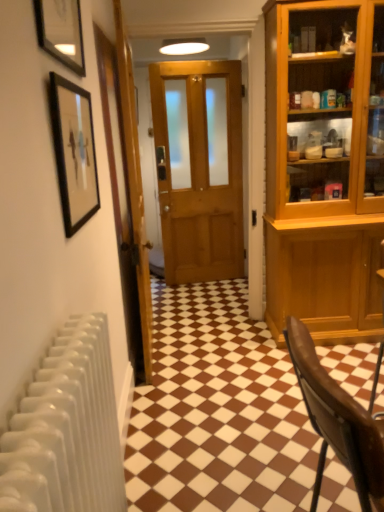
Question: Considering the relative sizes of brown leather chair at lower right and matte black picture frame at upper left, placed as the 2th picture frame when sorted from bottom to top, in the image provided, is brown leather chair at lower right bigger than matte black picture frame at upper left, placed as the 2th picture frame when sorted from bottom to top,?

Choices:
 (A) yes
 (B) no

Answer: (A)

Question: Considering the relative sizes of brown leather chair at lower right and matte black picture frame at upper left, which is counted as the 1th picture frame, starting from the top, in the image provided, is brown leather chair at lower right taller than matte black picture frame at upper left, which is counted as the 1th picture frame, starting from the top,?

Choices:
 (A) yes
 (B) no

Answer: (A)

Question: Is brown leather chair at lower right wider than matte black picture frame at upper left, placed as the 2th picture frame when sorted from bottom to top?

Choices:
 (A) yes
 (B) no

Answer: (A)

Question: From a real-world perspective, is brown leather chair at lower right below matte black picture frame at upper left, placed as the 2th picture frame when sorted from bottom to top?

Choices:
 (A) yes
 (B) no

Answer: (A)

Question: Could you tell me if brown leather chair at lower right is facing matte black picture frame at upper left, placed as the 2th picture frame when sorted from bottom to top?

Choices:
 (A) yes
 (B) no

Answer: (B)

Question: Can you confirm if brown leather chair at lower right is positioned to the right of matte black picture frame at upper left, which is counted as the 1th picture frame, starting from the top?

Choices:
 (A) yes
 (B) no

Answer: (A)

Question: Is wooden door at center, the second door positioned from the left, located outside wooden door at center, which is counted as the second door, starting from the right?

Choices:
 (A) yes
 (B) no

Answer: (A)

Question: From the image's perspective, is wooden door at center, the second door positioned from the left, on wooden door at center, the first door when ordered from left to right?

Choices:
 (A) no
 (B) yes

Answer: (B)

Question: Is wooden door at center, which is the first door from right to left, at the right side of wooden door at center, the first door when ordered from left to right?

Choices:
 (A) yes
 (B) no

Answer: (A)

Question: Can you confirm if wooden door at center, the second door positioned from the left, is smaller than wooden door at center, which is counted as the second door, starting from the right?

Choices:
 (A) no
 (B) yes

Answer: (B)

Question: Can you confirm if wooden door at center, the second door positioned from the left, is shorter than wooden door at center, the first door when ordered from left to right?

Choices:
 (A) no
 (B) yes

Answer: (A)

Question: From the image's perspective, would you say wooden door at center, the second door positioned from the left, is shown under wooden door at center, the first door when ordered from left to right?

Choices:
 (A) no
 (B) yes

Answer: (A)

Question: Does black framed picture at upper left, positioned as the 1th picture frame in bottom-to-top order, have a lesser height compared to matte black picture frame at upper left, which is counted as the 1th picture frame, starting from the top?

Choices:
 (A) yes
 (B) no

Answer: (B)